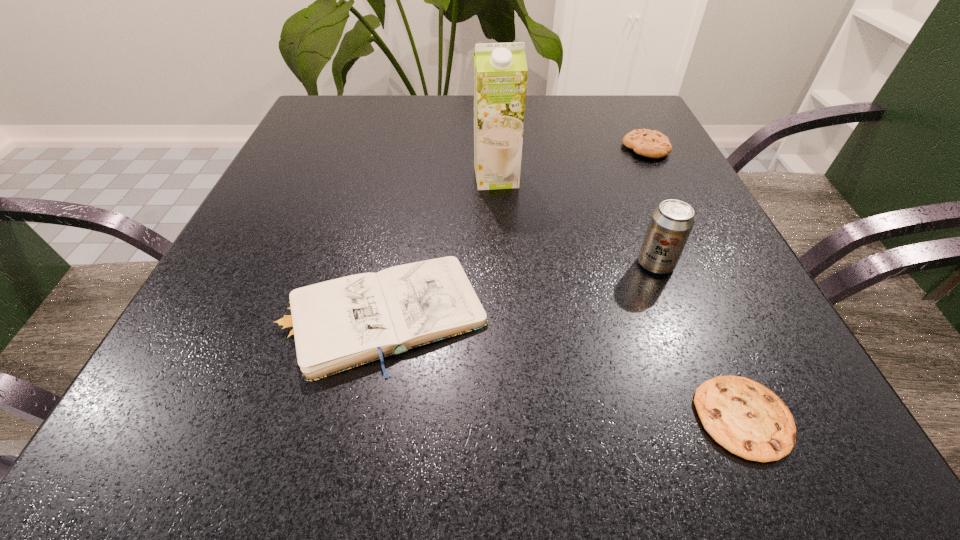
The height and width of the screenshot is (540, 960). Find the location of `free space located on the front of the notebook`. free space located on the front of the notebook is located at coordinates (355, 426).

Where is `vacant region located on the front of the farther cookie`? The image size is (960, 540). vacant region located on the front of the farther cookie is located at coordinates (678, 211).

Identify the location of free region located on the back of the nearer cookie. This screenshot has width=960, height=540. (659, 225).

You are a GUI agent. You are given a task and a screenshot of the screen. Output one action in this format:
    pyautogui.click(x=<x>, y=<y>)
    Task: Click on the object at the far edge
    Image resolution: width=960 pixels, height=540 pixels.
    Given the screenshot: What is the action you would take?
    pyautogui.click(x=653, y=144)

The image size is (960, 540). Find the location of `object positioned at the near edge`. object positioned at the near edge is located at coordinates (746, 418).

The width and height of the screenshot is (960, 540). What are the coordinates of `object at the left edge` in the screenshot? It's located at (336, 325).

Locate an element on the screen. The image size is (960, 540). beer can at the right edge is located at coordinates (670, 226).

Find the location of `object that is at the far right corner`. object that is at the far right corner is located at coordinates (653, 144).

Find the location of `object that is at the near right corner`. object that is at the near right corner is located at coordinates (746, 418).

Where is `vacant area at the far edge`? The image size is (960, 540). vacant area at the far edge is located at coordinates (398, 106).